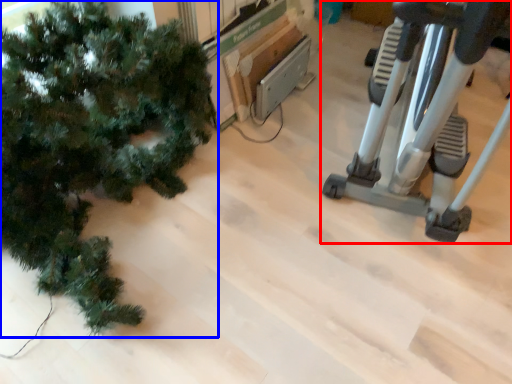
Question: Which point is further to the camera, stationary bicycle (highlighted by a red box) or christmas tree (highlighted by a blue box)?

Choices:
 (A) stationary bicycle
 (B) christmas tree

Answer: (B)